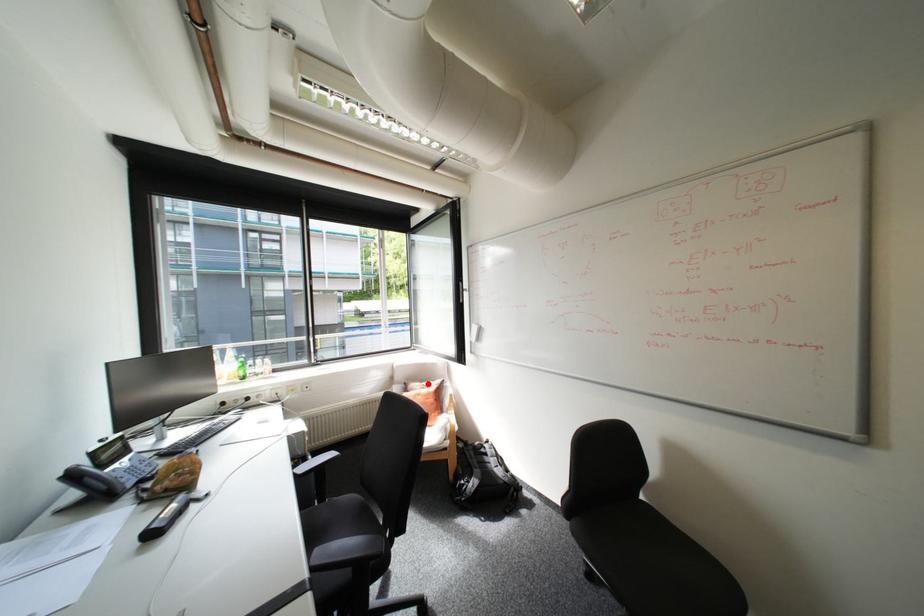
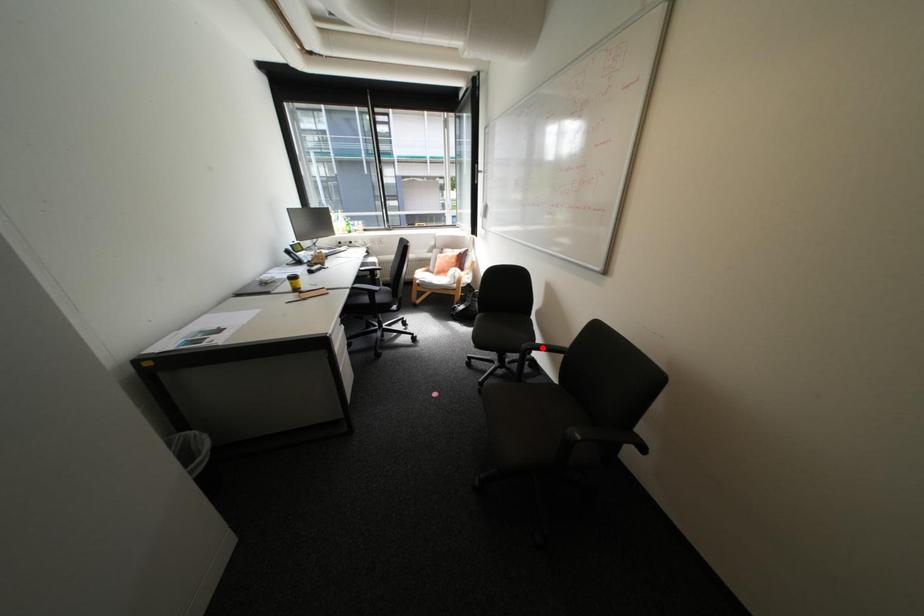
I am providing you with two images of the same scene from different viewpoints. A red point is marked on the first image and another point is marked on the second image. Do the highlighted points in image1 and image2 indicate the same real-world spot?

No